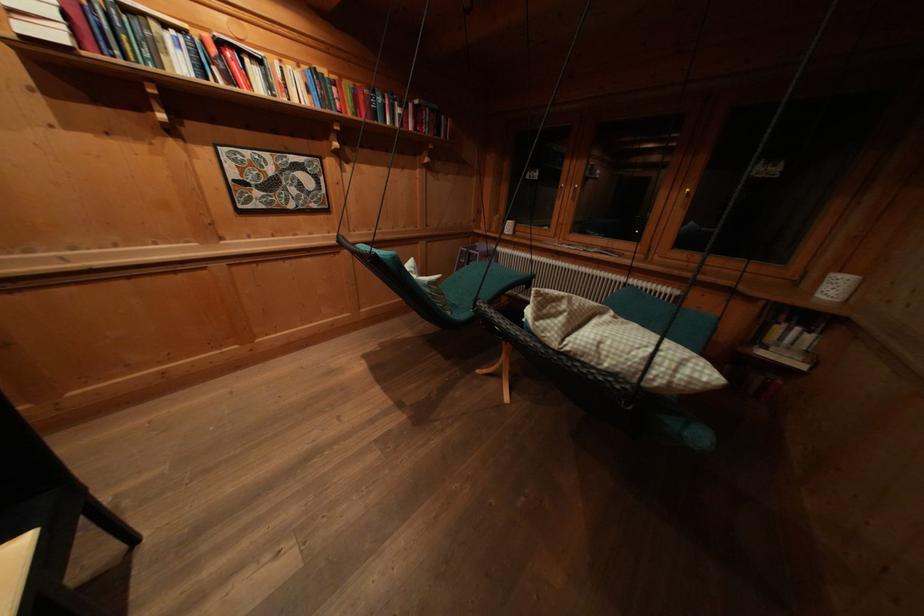
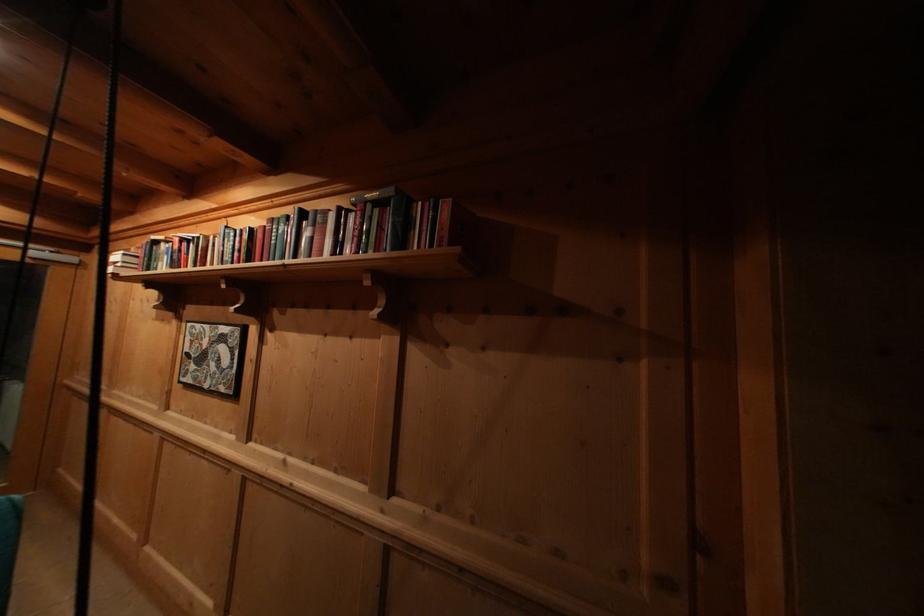
The point at (433, 115) is marked in the first image. Where is the corresponding point in the second image?

(375, 211)